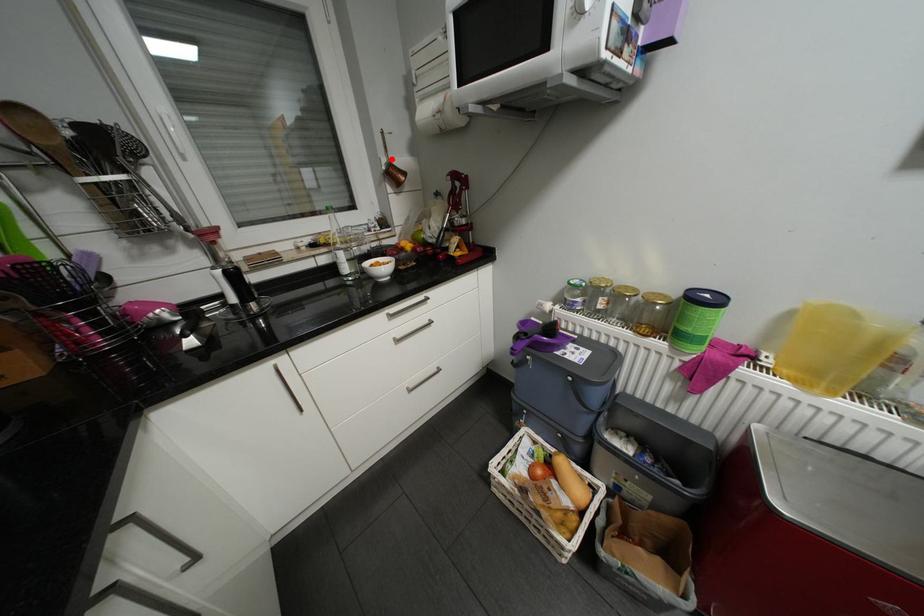
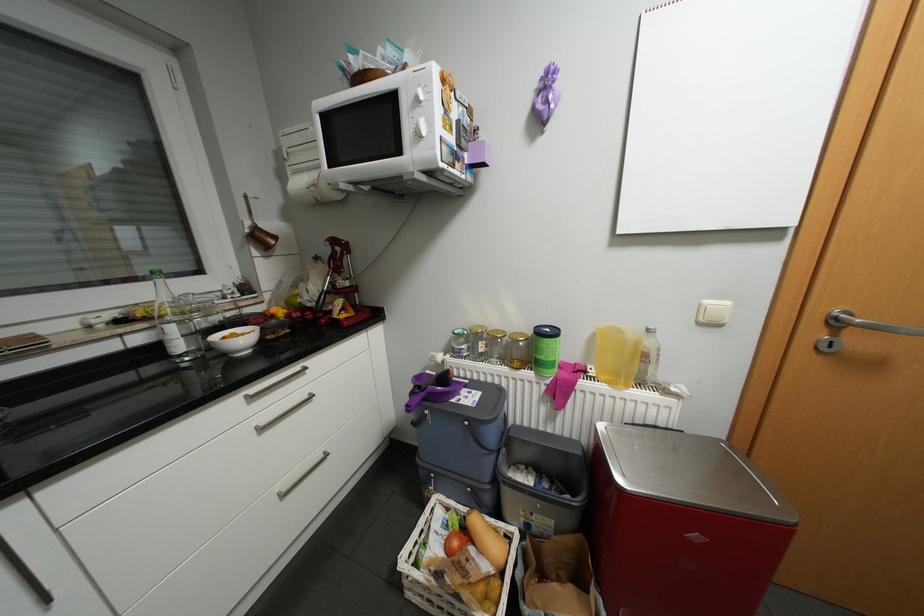
Find the pixel in the second image that matches the highlighted location in the first image.

(256, 223)